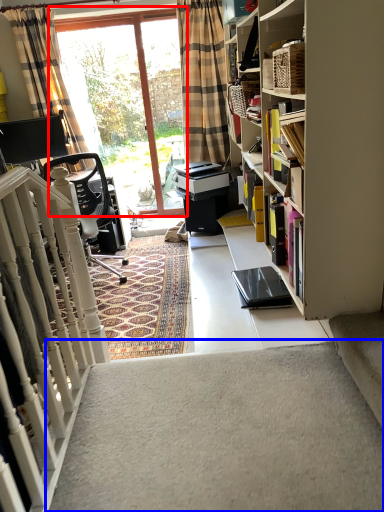
Question: Which point is further to the camera, window (highlighted by a red box) or stairwell (highlighted by a blue box)?

Choices:
 (A) window
 (B) stairwell

Answer: (A)